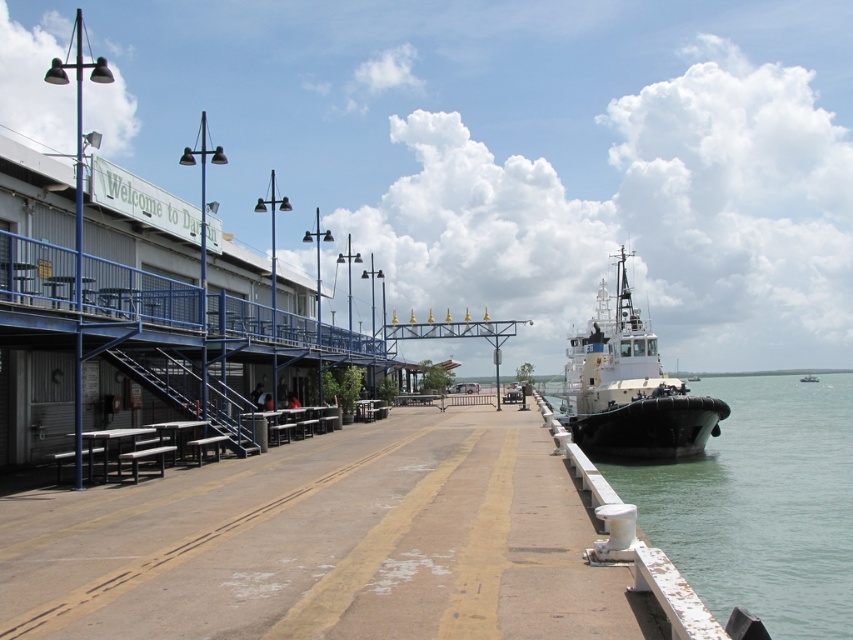
Question: Among these objects, which one is nearest to the camera?

Choices:
 (A) greenish water at lower right
 (B) white matte tugboat at right

Answer: (A)

Question: Is greenish water at lower right bigger than white matte tugboat at right?

Choices:
 (A) no
 (B) yes

Answer: (B)

Question: Does greenish water at lower right appear under white matte tugboat at right?

Choices:
 (A) no
 (B) yes

Answer: (B)

Question: Which point appears closest to the camera in this image?

Choices:
 (A) (701, 440)
 (B) (393, 456)

Answer: (B)

Question: Does brown concrete dock at center appear on the left side of white matte tugboat at right?

Choices:
 (A) yes
 (B) no

Answer: (A)

Question: Which point is farther to the camera?

Choices:
 (A) brown concrete dock at center
 (B) white matte tugboat at right

Answer: (B)